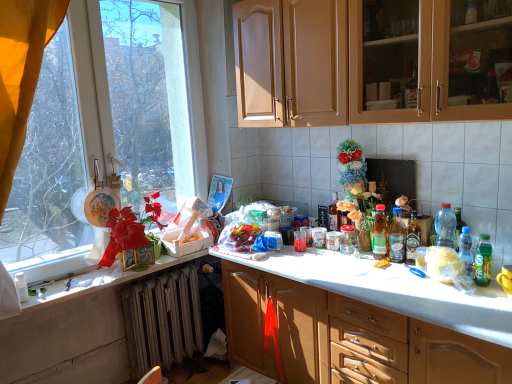
Where is `vacant space in front of translucent glass bottle at center, placed as the fourth bottle when sorted from right to left`? vacant space in front of translucent glass bottle at center, placed as the fourth bottle when sorted from right to left is located at coordinates pos(396,269).